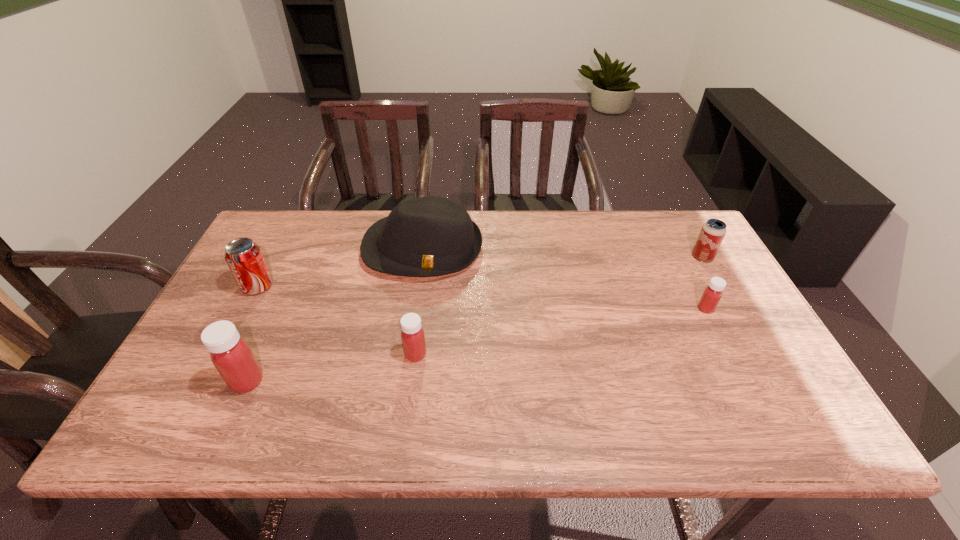
Find the location of a particular element. This screenshot has width=960, height=540. free spot located on the right of the second medicine from left to right is located at coordinates (480, 354).

Find the location of a particular element. free region located 0.240m on the front of the third nearest object is located at coordinates (749, 394).

Where is `free space located 0.330m on the front-facing side of the fedora`? The image size is (960, 540). free space located 0.330m on the front-facing side of the fedora is located at coordinates tap(403, 384).

You are a GUI agent. You are given a task and a screenshot of the screen. Output one action in this format:
    pyautogui.click(x=<x>, y=<y>)
    Task: Click on the blank space located 0.070m on the left of the rightmost object
    The image size is (960, 540).
    Given the screenshot: What is the action you would take?
    pyautogui.click(x=669, y=257)

In order to click on free space located on the front of the soda can in this screenshot , I will do `click(200, 396)`.

You are a GUI agent. You are given a task and a screenshot of the screen. Output one action in this format:
    pyautogui.click(x=<x>, y=<y>)
    Task: Click on the fedora that is positioned at the far edge
    Image resolution: width=960 pixels, height=540 pixels.
    Given the screenshot: What is the action you would take?
    pyautogui.click(x=428, y=236)

Identify the location of beer can that is at the far edge. Image resolution: width=960 pixels, height=540 pixels. (712, 233).

This screenshot has height=540, width=960. I want to click on object that is at the near edge, so click(x=231, y=355).

This screenshot has height=540, width=960. What are the coordinates of `medicine situated at the left edge` in the screenshot? It's located at (231, 355).

Locate an element on the screen. The image size is (960, 540). soda can that is at the left edge is located at coordinates (244, 257).